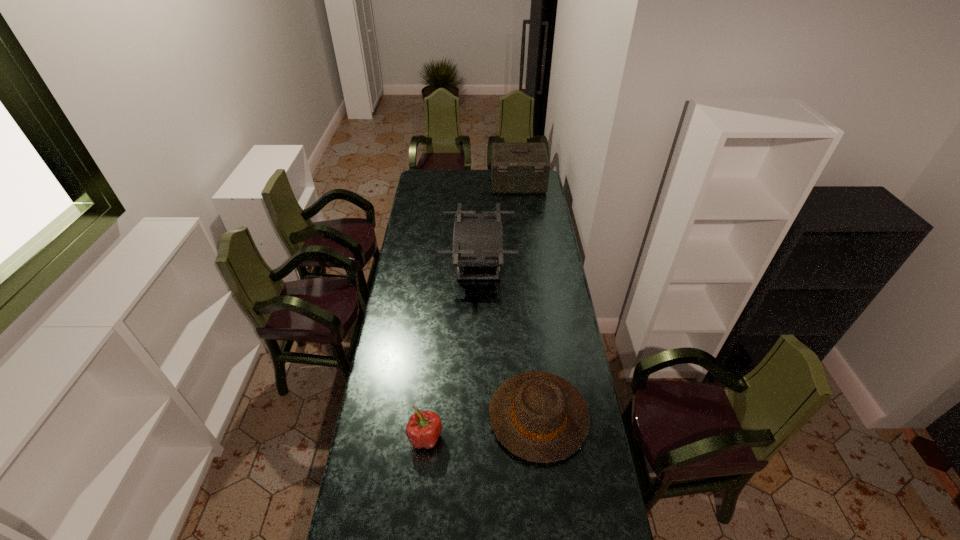
What are the coordinates of `object at the left edge` in the screenshot? It's located at (424, 427).

Where is `the first-aid kit positioned at the right edge`? the first-aid kit positioned at the right edge is located at coordinates [x=516, y=168].

Find the location of a particular element. The height and width of the screenshot is (540, 960). cowboy hat present at the right edge is located at coordinates (540, 417).

I want to click on object that is at the far right corner, so click(516, 168).

In the image, there is a desktop. At what (x,y) coordinates should I click in order to perform the action: click on free space at the left edge. Please return your answer as a coordinate pair (x, y). Looking at the image, I should click on click(392, 454).

Find the location of `free spot at the right edge of the desktop`. free spot at the right edge of the desktop is located at coordinates (543, 203).

Where is `empty space that is in between the cowboy hat and the first-aid kit`? Image resolution: width=960 pixels, height=540 pixels. empty space that is in between the cowboy hat and the first-aid kit is located at coordinates click(528, 300).

Where is `blank region between the cowboy hat and the first-aid kit`? The height and width of the screenshot is (540, 960). blank region between the cowboy hat and the first-aid kit is located at coordinates (528, 300).

You are a GUI agent. You are given a task and a screenshot of the screen. Output one action in this format:
    pyautogui.click(x=<x>, y=<y>)
    Task: Click on the vacant region between the third nearest object and the cowboy hat
    This screenshot has width=960, height=540.
    Given the screenshot: What is the action you would take?
    pyautogui.click(x=509, y=339)

The image size is (960, 540). Find the location of `vacant area between the second tallest object and the cowboy hat`. vacant area between the second tallest object and the cowboy hat is located at coordinates (509, 339).